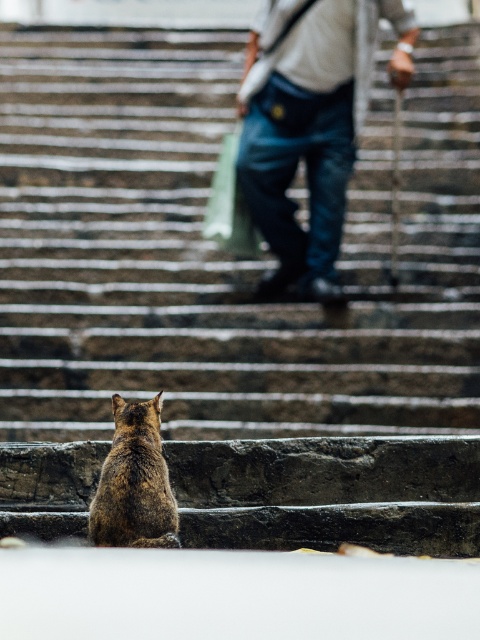
In the scene shown: You are a photographer trying to capture a photo of the denim jeans at upper center without the brown fur cat at lower left appearing in the frame. Based on their positions, is this possible?

The brown fur cat at lower left is behind denim jeans at upper center, so the cat is not in front of the jeans. Therefore, it is possible to take a photo of the denim jeans at upper center without the cat appearing in the frame.

You are standing at the bottom of the stairs and want to reach the top. There are two points marked on the image. The first point is at coordinate point (263, 48) and the second is at point (145, 468). Which point should you step on first to reach the top?

A: Point (263, 48) is behind point (145, 468), so you should step on point (145, 468) first to reach the top.

You are a photographer trying to capture a photo of the brown fur cat at lower left without the denim jeans at upper center blocking the view. Can you adjust your position to do so?

The denim jeans at upper center is positioned over the brown fur cat at lower left, so moving your camera position lower or to the side might allow you to capture the cat without the jeans blocking the view.